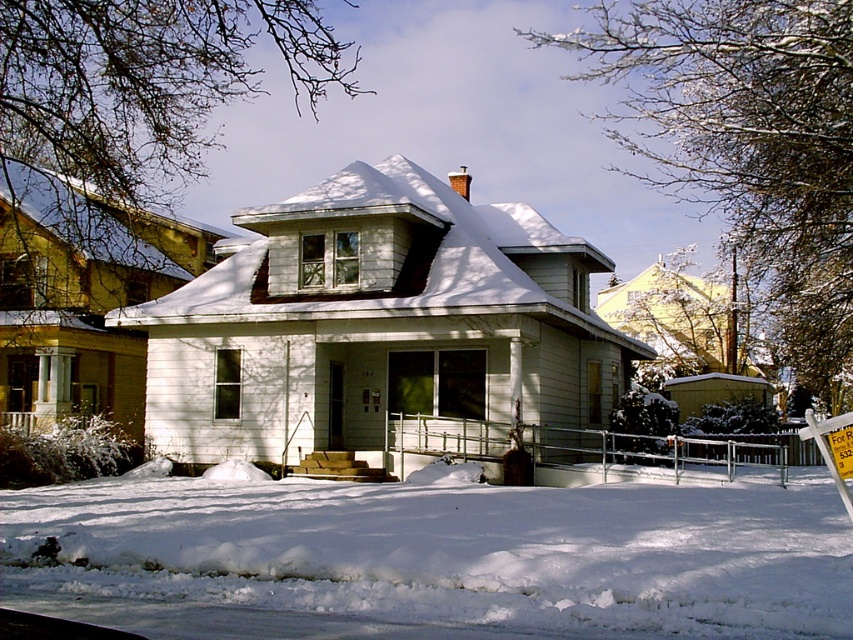
Can you confirm if white fluffy snow at lower center is smaller than white plastic sign at lower right?

Actually, white fluffy snow at lower center might be larger than white plastic sign at lower right.

Who is positioned more to the left, white fluffy snow at lower center or white plastic sign at lower right?

white fluffy snow at lower center

Which is behind, point (152, 541) or point (825, 422)?

Positioned behind is point (152, 541).

The image size is (853, 640). I want to click on white fluffy snow at lower center, so click(456, 550).